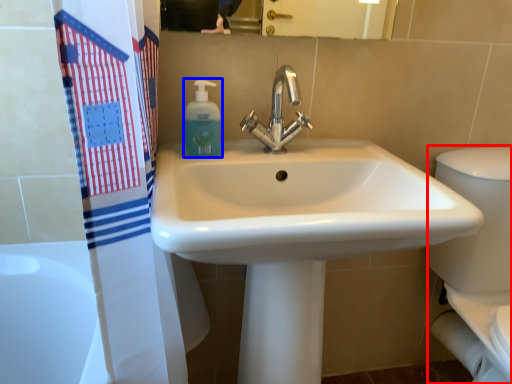
Question: Which object appears farthest to the camera in this image, porcelain (highlighted by a red box) or soap dispenser (highlighted by a blue box)?

Choices:
 (A) porcelain
 (B) soap dispenser

Answer: (B)